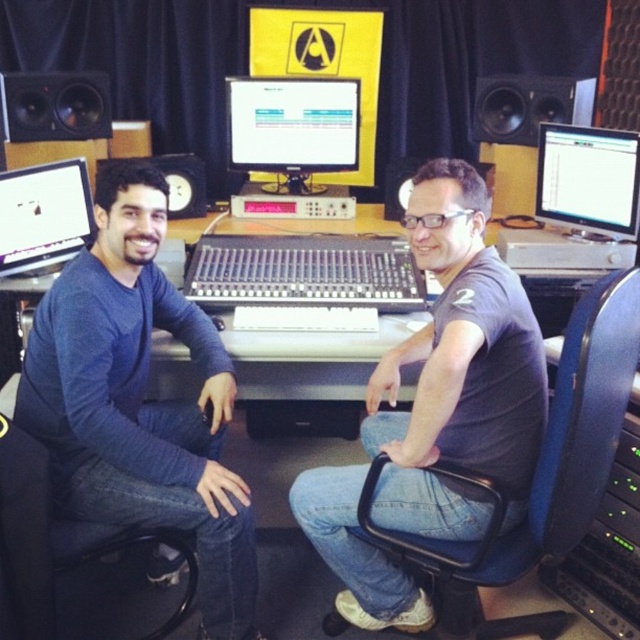
Question: Which point is farther to the camera?

Choices:
 (A) (492, 109)
 (B) (548, 416)
 (C) (566, 145)

Answer: (A)

Question: Where is dark gray t-shirt at center located in relation to black fabric swivel chair at left in the image?

Choices:
 (A) below
 (B) above

Answer: (B)

Question: Considering the real-world distances, which object is farthest from the matte black monitor at left?

Choices:
 (A) blue plastic swivel chair at right
 (B) black fabric swivel chair at left
 (C) blue cotton shirt at center

Answer: (A)

Question: Which of the following is the farthest from the observer?

Choices:
 (A) (298, 150)
 (B) (476, 120)
 (C) (556, 202)
 (D) (74, 246)

Answer: (A)

Question: Is the position of dark gray t-shirt at center less distant than that of black fabric swivel chair at left?

Choices:
 (A) yes
 (B) no

Answer: (A)

Question: Is dark gray t-shirt at center above matte black monitor at center?

Choices:
 (A) no
 (B) yes

Answer: (A)